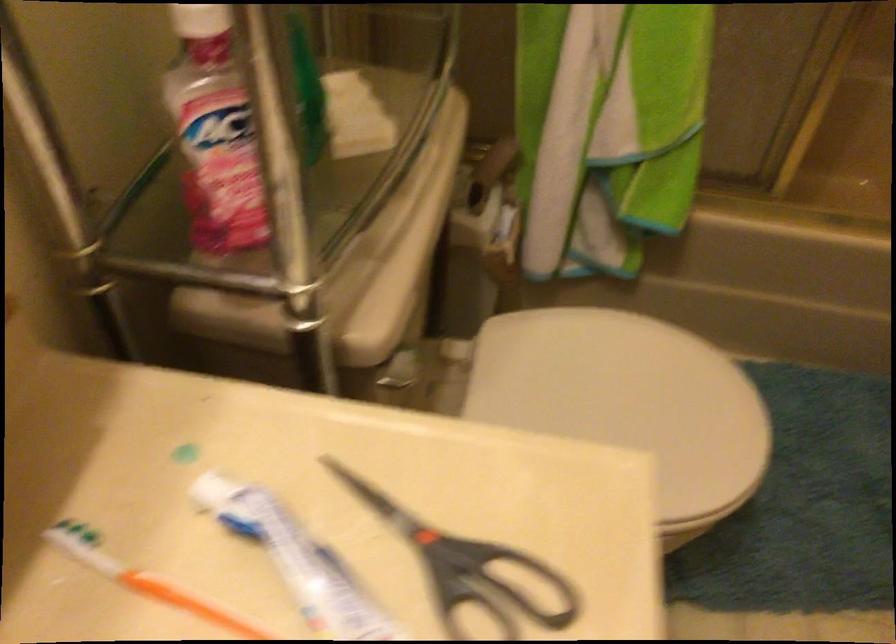
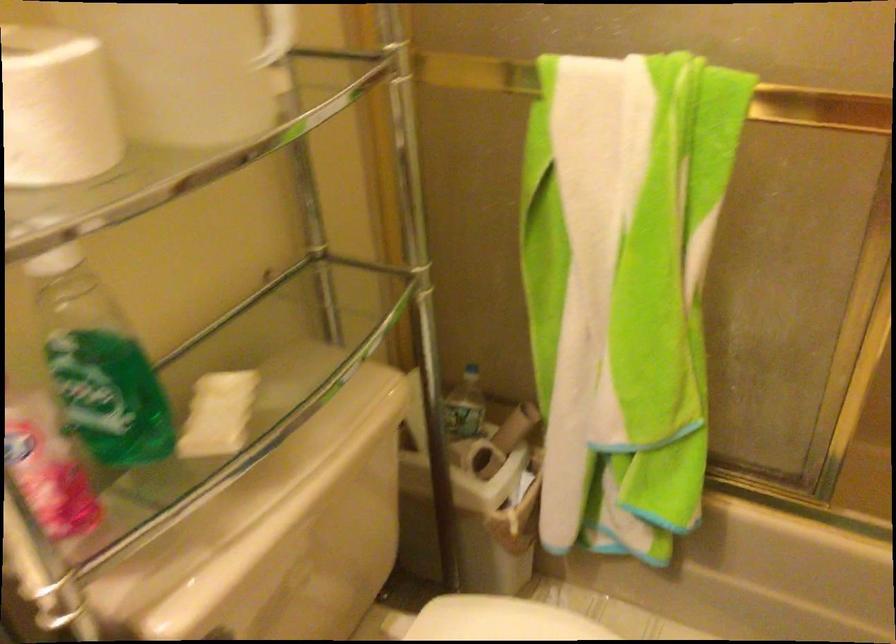
Where in the second image is the point corresponding to point (572, 73) from the first image?

(575, 353)